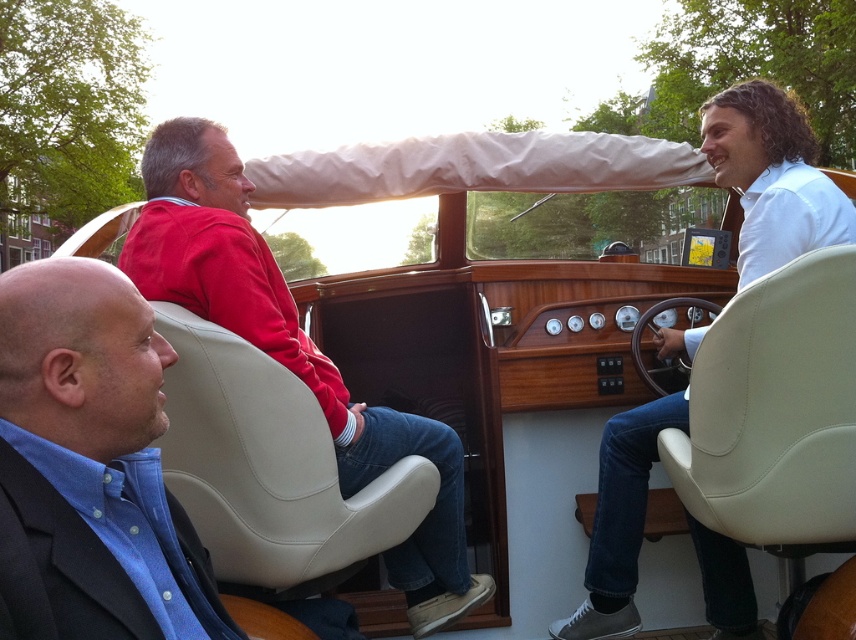
This screenshot has height=640, width=856. Describe the element at coordinates (292, 349) in the screenshot. I see `matte red sweater at center` at that location.

Is matte red sweater at center bigger than white matte shirt at center?

Incorrect, matte red sweater at center is not larger than white matte shirt at center.

The width and height of the screenshot is (856, 640). What do you see at coordinates (292, 349) in the screenshot? I see `matte red sweater at center` at bounding box center [292, 349].

Find the location of a particular element. The width and height of the screenshot is (856, 640). matte red sweater at center is located at coordinates (292, 349).

Is blue cotton shirt at left thinner than white matte shirt at center?

Yes, blue cotton shirt at left is thinner than white matte shirt at center.

Who is more forward, (107,348) or (770,189)?

Positioned in front is point (107,348).

Where is `blue cotton shirt at left`? This screenshot has height=640, width=856. blue cotton shirt at left is located at coordinates (80, 358).

Does blue cotton shirt at left have a lesser height compared to matte red sweater at center?

Correct, blue cotton shirt at left is not as tall as matte red sweater at center.

Is blue cotton shirt at left to the left of matte red sweater at center from the viewer's perspective?

Correct, you'll find blue cotton shirt at left to the left of matte red sweater at center.

Locate an element on the screen. The width and height of the screenshot is (856, 640). blue cotton shirt at left is located at coordinates (80, 358).

You are a GUI agent. You are given a task and a screenshot of the screen. Output one action in this format:
    pyautogui.click(x=<x>, y=<y>)
    Task: Click on the blue cotton shirt at left
    
    Given the screenshot: What is the action you would take?
    pyautogui.click(x=80, y=358)